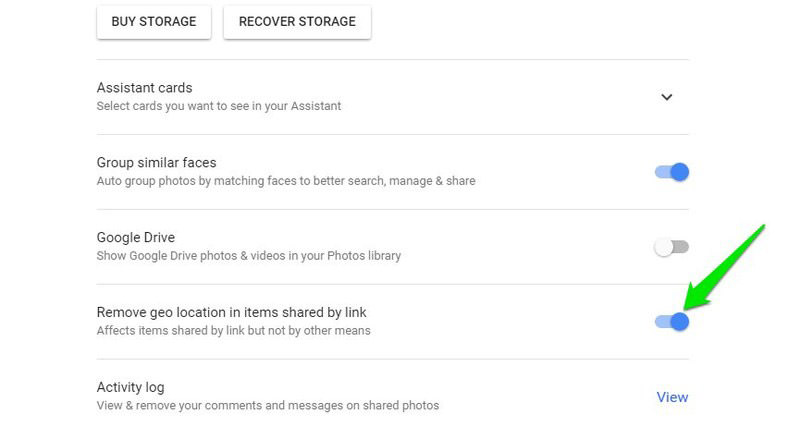
At what (x,y) coordinates should I click in order to perform the action: click on computer. Please return your answer as a coordinate pair (x, y). Image resolution: width=800 pixels, height=427 pixels. Looking at the image, I should click on (506, 269).